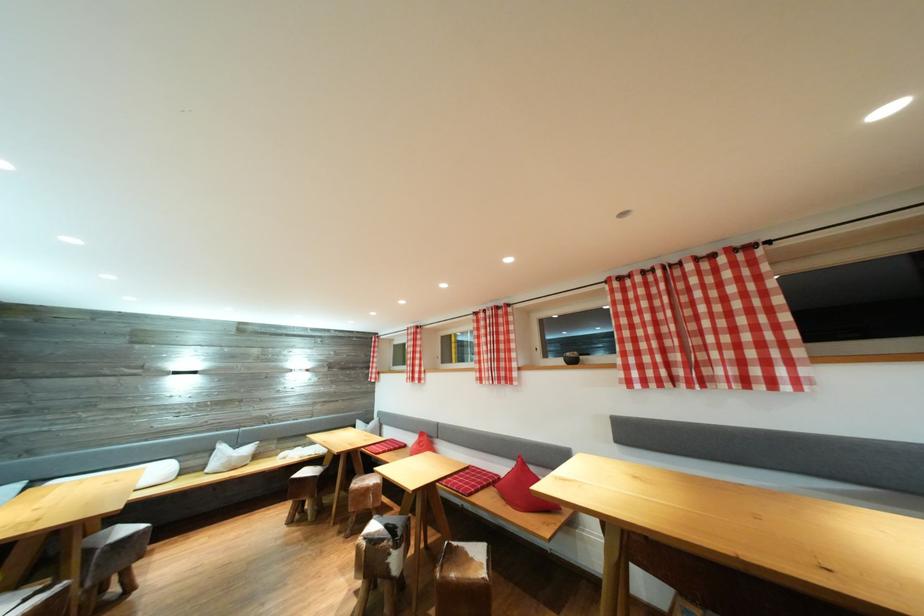
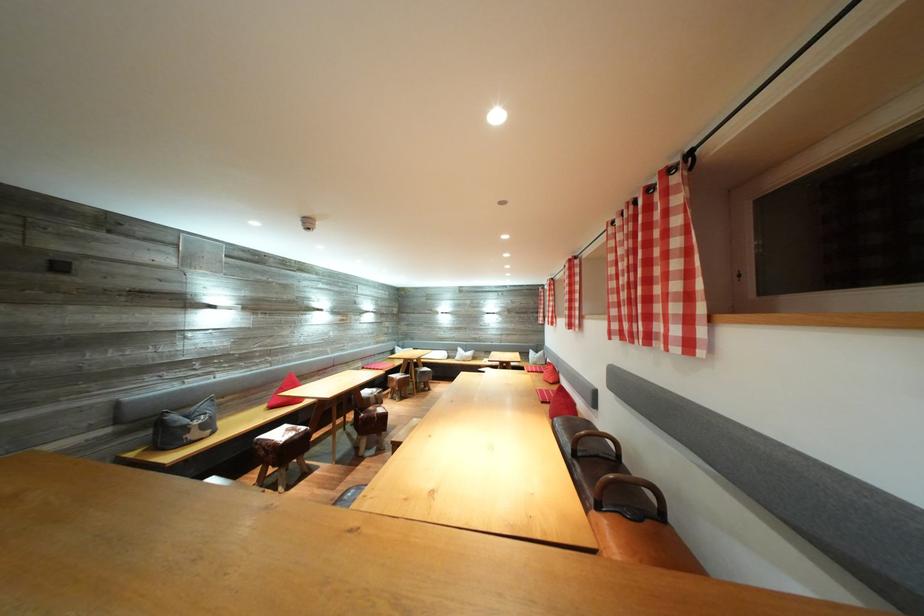
Where in the second image is the point corresponding to point 641,379 from the first image?

(622, 331)